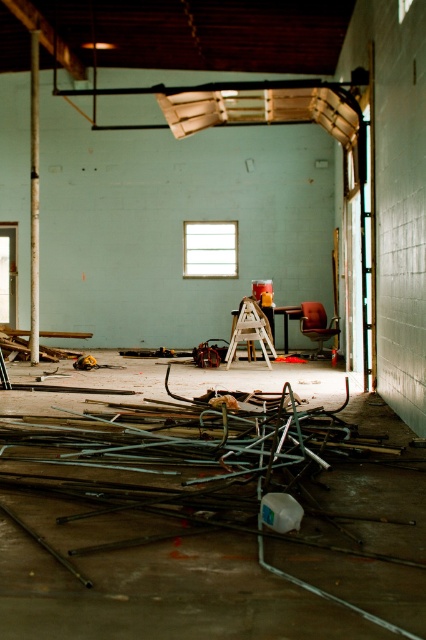
Question: Which point appears farthest from the camera in this image?

Choices:
 (A) (204, 545)
 (B) (319, 356)

Answer: (B)

Question: Does metallic gray metal at center appear on the right side of leatherette office chair at center?

Choices:
 (A) yes
 (B) no

Answer: (B)

Question: Which of the following is the closest to the observer?

Choices:
 (A) leatherette office chair at center
 (B) matte white beam at left
 (C) metallic gray metal at center

Answer: (C)

Question: Is the position of metallic gray metal at center less distant than that of matte white beam at left?

Choices:
 (A) no
 (B) yes

Answer: (B)

Question: From the image, what is the correct spatial relationship of matte white beam at left in relation to leatherette office chair at center?

Choices:
 (A) left
 (B) right

Answer: (A)

Question: Considering the real-world distances, which object is farthest from the metallic gray metal at center?

Choices:
 (A) leatherette office chair at center
 (B) matte white beam at left

Answer: (A)